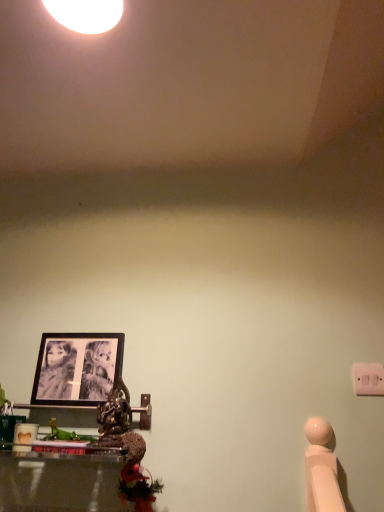
Question: Can you confirm if black matte picture frame at left is bigger than white plastic light switch at right?

Choices:
 (A) no
 (B) yes

Answer: (B)

Question: Is white plastic light switch at right at the back of black matte picture frame at left?

Choices:
 (A) no
 (B) yes

Answer: (A)

Question: Does black matte picture frame at left lie behind white plastic light switch at right?

Choices:
 (A) yes
 (B) no

Answer: (A)

Question: Does black matte picture frame at left have a lesser height compared to white plastic light switch at right?

Choices:
 (A) yes
 (B) no

Answer: (B)

Question: Considering the relative sizes of black matte picture frame at left and white plastic light switch at right in the image provided, is black matte picture frame at left smaller than white plastic light switch at right?

Choices:
 (A) no
 (B) yes

Answer: (A)

Question: Is the position of black matte picture frame at left less distant than that of white plastic light switch at right?

Choices:
 (A) yes
 (B) no

Answer: (B)

Question: Could you tell me if white plastic light switch at right is turned towards black matte picture frame at left?

Choices:
 (A) yes
 (B) no

Answer: (B)

Question: Does white plastic light switch at right have a larger size compared to black matte picture frame at left?

Choices:
 (A) yes
 (B) no

Answer: (B)

Question: Is the position of white plastic light switch at right less distant than that of black matte picture frame at left?

Choices:
 (A) yes
 (B) no

Answer: (A)

Question: Is white plastic light switch at right wider than black matte picture frame at left?

Choices:
 (A) yes
 (B) no

Answer: (B)

Question: Can you confirm if white plastic light switch at right is shorter than black matte picture frame at left?

Choices:
 (A) no
 (B) yes

Answer: (B)

Question: From the image's perspective, is white plastic light switch at right below black matte picture frame at left?

Choices:
 (A) yes
 (B) no

Answer: (A)

Question: Is point (354, 388) positioned closer to the camera than point (115, 350)?

Choices:
 (A) closer
 (B) farther

Answer: (A)